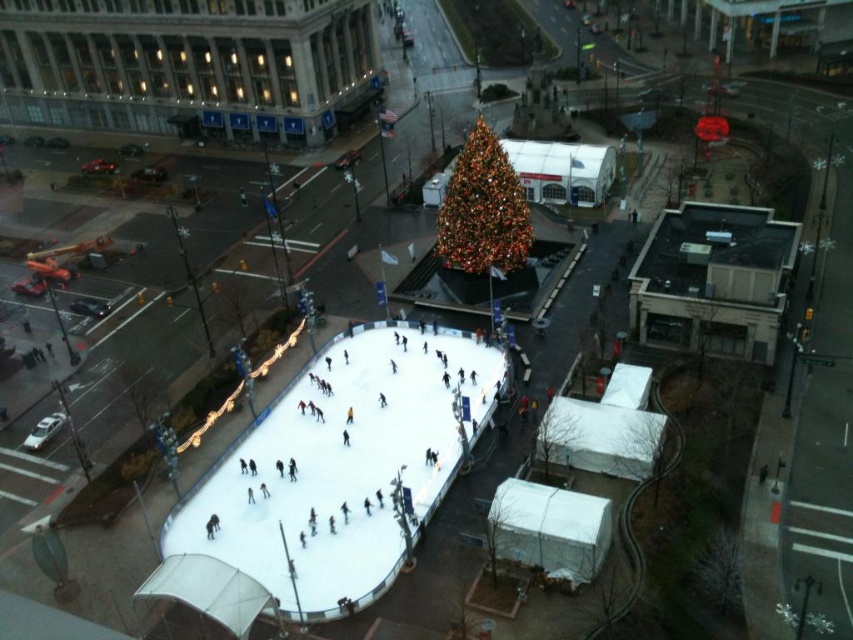
Image resolution: width=853 pixels, height=640 pixels. Describe the element at coordinates (344, 468) in the screenshot. I see `white smooth ice skating rink at center` at that location.

Which of these two, white smooth ice skating rink at center or iridescent glass christmas tree at center, stands shorter?

white smooth ice skating rink at center

Describe the element at coordinates (344, 468) in the screenshot. I see `white smooth ice skating rink at center` at that location.

In order to click on white smooth ice skating rink at center in this screenshot , I will do `click(344, 468)`.